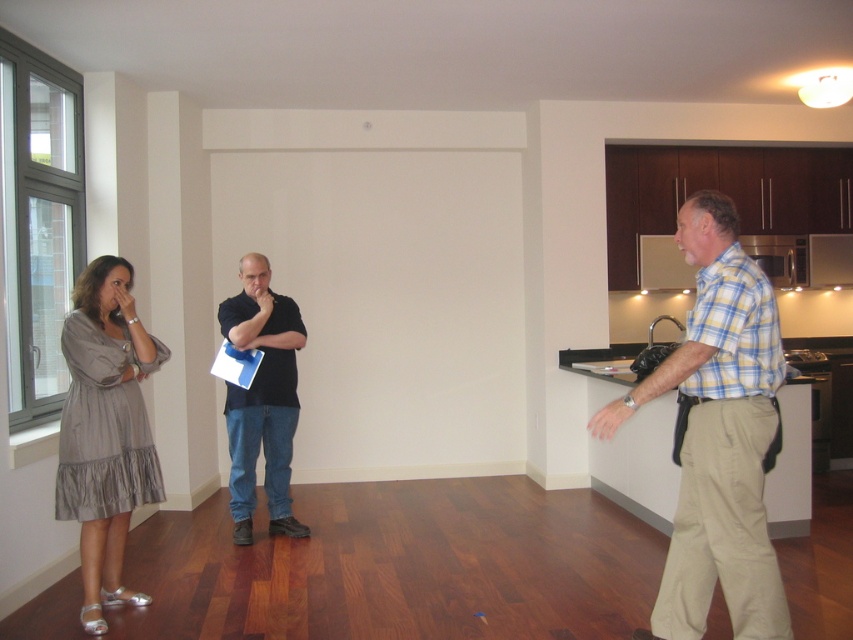
You are a photographer setting up a shoot in this apartment. You need to place a large equipment box that requires 2 meters of space. You see the yellow plaid shirt at right and the gray cotton dress at left. Which area can accommodate the box without overlapping either clothing item?

The yellow plaid shirt at right is bigger than the gray cotton dress at left, so the area around the yellow plaid shirt at right has more space and can accommodate the equipment box.

You are standing in the center of the room and want to hand a document to the person wearing the yellow plaid shirt at right. Which direction should you move to reach them?

The yellow plaid shirt at right is located at point (717, 435), so you should move towards the right side of the room to reach the person wearing the yellow plaid shirt at right.